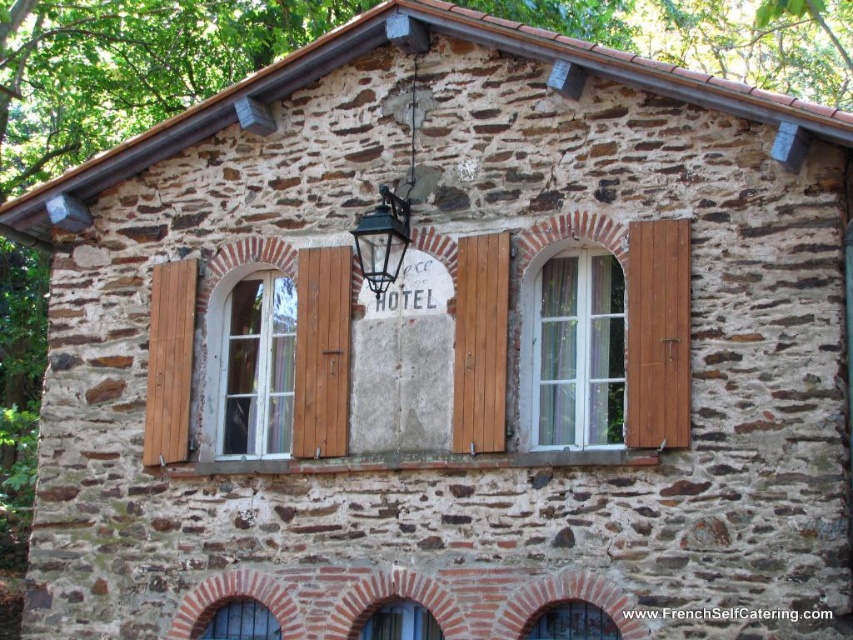
Question: Which of the following is the closest to the observer?

Choices:
 (A) metallic blue window at lower center
 (B) brown wooden shutter at center
 (C) wooden at center
 (D) white glass window at center

Answer: (B)

Question: Can you confirm if brown wooden shutter at right is positioned to the left of wooden at left?

Choices:
 (A) yes
 (B) no

Answer: (B)

Question: Can you confirm if white wood window at center left is positioned below clear glass window at center?

Choices:
 (A) yes
 (B) no

Answer: (B)

Question: Among these points, which one is nearest to the camera?

Choices:
 (A) (207, 634)
 (B) (300, 372)
 (C) (589, 324)

Answer: (C)

Question: Which point is farther from the camera taking this photo?

Choices:
 (A) (397, 236)
 (B) (396, 616)
 (C) (245, 394)

Answer: (C)

Question: Does brown wooden shutter at center appear on the left side of metallic blue window at lower center?

Choices:
 (A) no
 (B) yes

Answer: (A)